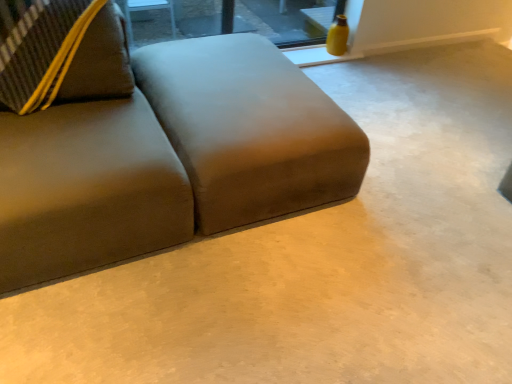
What is the approximate height of suede-like brown couch at left?

suede-like brown couch at left is 29.50 inches in height.

This screenshot has width=512, height=384. I want to click on suede-like brown couch at left, so click(x=170, y=158).

Describe the element at coordinates (170, 158) in the screenshot. I see `suede-like brown couch at left` at that location.

Describe the element at coordinates (287, 20) in the screenshot. Image resolution: width=512 pixels, height=384 pixels. I see `transparent glass window at upper center` at that location.

The height and width of the screenshot is (384, 512). I want to click on transparent glass window at upper center, so click(x=287, y=20).

Locate an element on the screen. The height and width of the screenshot is (384, 512). suede-like brown couch at left is located at coordinates (170, 158).

Based on their positions, is suede-like brown couch at left located to the left or right of transparent glass window at upper center?

From the image, it's evident that suede-like brown couch at left is to the left of transparent glass window at upper center.

Considering their positions, is suede-like brown couch at left located in front of or behind transparent glass window at upper center?

Clearly, suede-like brown couch at left is in front of transparent glass window at upper center.

Does point (61, 132) come behind point (289, 31)?

No, it is in front of (289, 31).

From the image's perspective, which is above, suede-like brown couch at left or transparent glass window at upper center?

transparent glass window at upper center appears higher in the image.

From a real-world perspective, between suede-like brown couch at left and transparent glass window at upper center, who is vertically lower?

In real-world perspective, transparent glass window at upper center is lower.

Does suede-like brown couch at left have a greater width compared to transparent glass window at upper center?

Yes.

Is suede-like brown couch at left taller or shorter than transparent glass window at upper center?

In the image, suede-like brown couch at left appears to be taller than transparent glass window at upper center.

Can you confirm if suede-like brown couch at left is smaller than transparent glass window at upper center?

Actually, suede-like brown couch at left might be larger than transparent glass window at upper center.

Does suede-like brown couch at left contain transparent glass window at upper center?

Definitely not — transparent glass window at upper center is not inside suede-like brown couch at left.

Is suede-like brown couch at left far from transparent glass window at upper center?

suede-like brown couch at left is far away from transparent glass window at upper center.

Is suede-like brown couch at left oriented towards transparent glass window at upper center?

No, suede-like brown couch at left is not turned towards transparent glass window at upper center.

How many degrees apart are the facing directions of suede-like brown couch at left and transparent glass window at upper center?

0.148 degrees separate the facing orientations of suede-like brown couch at left and transparent glass window at upper center.

How much distance is there between suede-like brown couch at left and transparent glass window at upper center?

→ They are 4.51 feet apart.

Where is `studio couch located in front of the transparent glass window at upper center`? The image size is (512, 384). studio couch located in front of the transparent glass window at upper center is located at coordinates click(170, 158).

Considering the relative positions of transparent glass window at upper center and suede-like brown couch at left in the image provided, is transparent glass window at upper center to the left or to the right of suede-like brown couch at left?

transparent glass window at upper center is positioned on suede-like brown couch at left's right side.

In the image, is transparent glass window at upper center positioned in front of or behind suede-like brown couch at left?

Clearly, transparent glass window at upper center is behind suede-like brown couch at left.

Considering the positions of points (142, 30) and (5, 216), is point (142, 30) closer to camera compared to point (5, 216)?

No, (142, 30) is behind (5, 216).

Looking at this image, from the image's perspective, which is above, transparent glass window at upper center or suede-like brown couch at left?

transparent glass window at upper center is shown above in the image.

From a real-world perspective, who is located higher, transparent glass window at upper center or suede-like brown couch at left?

In real-world perspective, suede-like brown couch at left is above.

Can you confirm if transparent glass window at upper center is thinner than suede-like brown couch at left?

Yes, transparent glass window at upper center is thinner than suede-like brown couch at left.

Does transparent glass window at upper center have a lesser height compared to suede-like brown couch at left?

Yes.

Can you confirm if transparent glass window at upper center is bigger than suede-like brown couch at left?

Incorrect, transparent glass window at upper center is not larger than suede-like brown couch at left.

Can we say transparent glass window at upper center lies outside suede-like brown couch at left?

Absolutely, transparent glass window at upper center is external to suede-like brown couch at left.

Are transparent glass window at upper center and suede-like brown couch at left far apart?

transparent glass window at upper center is far away from suede-like brown couch at left.

Could you tell me if transparent glass window at upper center is turned towards suede-like brown couch at left?

Yes, transparent glass window at upper center faces towards suede-like brown couch at left.

What's the angular difference between transparent glass window at upper center and suede-like brown couch at left's facing directions?

transparent glass window at upper center and suede-like brown couch at left are facing 0.148 degrees away from each other.

Locate an element on the screen. The width and height of the screenshot is (512, 384). studio couch to the left of transparent glass window at upper center is located at coordinates (170, 158).

Locate an element on the screen. studio couch that appears in front of the transparent glass window at upper center is located at coordinates (170, 158).

In the image, there is a suede-like brown couch at left. In order to click on window above it (from the image's perspective) in this screenshot , I will do [287, 20].